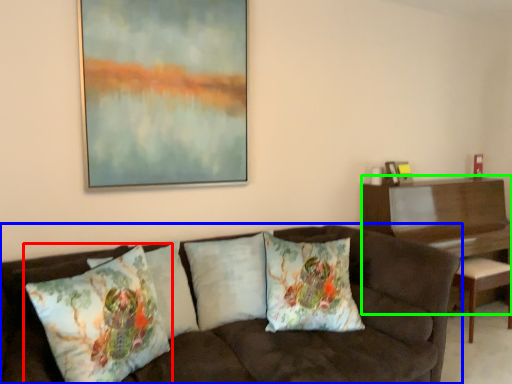
Question: Which object is the closest to the pillow (highlighted by a red box)? Choose among these: studio couch (highlighted by a blue box) or table (highlighted by a green box).

Choices:
 (A) studio couch
 (B) table

Answer: (A)